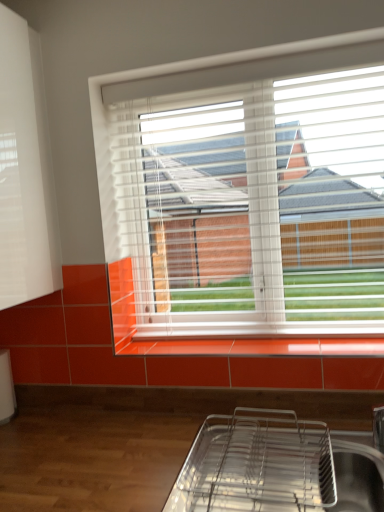
Where is `white plastic blinds at upper center`? white plastic blinds at upper center is located at coordinates (250, 192).

What do you see at coordinates (25, 170) in the screenshot?
I see `white matte shutter at upper left` at bounding box center [25, 170].

You are a GUI agent. You are given a task and a screenshot of the screen. Output one action in this format:
    pyautogui.click(x=<x>, y=<y>)
    Task: Click on the white plastic blinds at upper center
    This screenshot has height=512, width=384.
    Given the screenshot: What is the action you would take?
    pyautogui.click(x=250, y=192)

In the scene shown: Is white matte shutter at upper left bigger or smaller than metallic silver tray at lower center?

white matte shutter at upper left is bigger than metallic silver tray at lower center.

Is white matte shutter at upper left aimed at metallic silver tray at lower center?

No, white matte shutter at upper left is not turned towards metallic silver tray at lower center.

Is metallic silver tray at lower center inside white matte shutter at upper left?

No, metallic silver tray at lower center is located outside of white matte shutter at upper left.

From the image's perspective, is orange glossy tile at lower center located above or below white matte shutter at upper left?

orange glossy tile at lower center is situated lower than white matte shutter at upper left in the image.

Can you confirm if orange glossy tile at lower center is smaller than white matte shutter at upper left?

Indeed, orange glossy tile at lower center has a smaller size compared to white matte shutter at upper left.

Which is behind, orange glossy tile at lower center or white matte shutter at upper left?

orange glossy tile at lower center.

Which of these two, orange glossy tile at lower center or white matte shutter at upper left, is thinner?

Thinner between the two is orange glossy tile at lower center.

Is metallic silver tray at lower center wider than white plastic blinds at upper center?

Correct, the width of metallic silver tray at lower center exceeds that of white plastic blinds at upper center.

Is metallic silver tray at lower center located outside white plastic blinds at upper center?

That's correct, metallic silver tray at lower center is outside of white plastic blinds at upper center.

Considering the positions of points (267, 487) and (184, 68), is point (267, 487) farther from camera compared to point (184, 68)?

No, (267, 487) is in front of (184, 68).

From a real-world perspective, between metallic silver tray at lower center and white plastic blinds at upper center, who is vertically lower?

metallic silver tray at lower center.

Between point (136, 342) and point (195, 75), which one is positioned in front?

Point (195, 75)

From a real-world perspective, is orange glossy tile at lower center over white plastic blinds at upper center?

No.

Is orange glossy tile at lower center wider than white plastic blinds at upper center?

Yes.

In the image, there is a white plastic blinds at upper center. Find the location of `window sill below it (from a real-world perspective)`. window sill below it (from a real-world perspective) is located at coordinates (251, 346).

Can you confirm if metallic silver tray at lower center is positioned to the right of white matte shutter at upper left?

Yes, metallic silver tray at lower center is to the right of white matte shutter at upper left.

Locate an element on the screen. The image size is (384, 512). appliance located underneath the white matte shutter at upper left (from a real-world perspective) is located at coordinates (256, 464).

Do you think metallic silver tray at lower center is within white matte shutter at upper left, or outside of it?

metallic silver tray at lower center is spatially situated outside white matte shutter at upper left.

Between metallic silver tray at lower center and white matte shutter at upper left, which one has more height?

white matte shutter at upper left.

Does white matte shutter at upper left have a lesser height compared to white plastic blinds at upper center?

Yes, white matte shutter at upper left is shorter than white plastic blinds at upper center.

Is white plastic blinds at upper center surrounded by white matte shutter at upper left?

No, white plastic blinds at upper center is not a part of white matte shutter at upper left.

Relative to white plastic blinds at upper center, is white matte shutter at upper left in front or behind?

In the image, white matte shutter at upper left appears in front of white plastic blinds at upper center.

From a real-world perspective, who is located lower, white matte shutter at upper left or white plastic blinds at upper center?

white plastic blinds at upper center.

From a real-world perspective, is white plastic blinds at upper center physically above metallic silver tray at lower center?

Correct, in the physical world, white plastic blinds at upper center is higher than metallic silver tray at lower center.

Is white plastic blinds at upper center facing towards metallic silver tray at lower center?

No, white plastic blinds at upper center is not oriented towards metallic silver tray at lower center.

Between point (162, 179) and point (214, 424), which one is positioned in front?

The point (214, 424) is closer.

You are a GUI agent. You are given a task and a screenshot of the screen. Output one action in this format:
    pyautogui.click(x=<x>, y=<y>)
    Task: Click on the appliance below the white matte shutter at upper left (from a real-world perspective)
    
    Given the screenshot: What is the action you would take?
    pyautogui.click(x=256, y=464)

The height and width of the screenshot is (512, 384). What are the coordinates of `shutter in front of the orange glossy tile at lower center` in the screenshot? It's located at (25, 170).

Looking at the image, which one is located closer to white matte shutter at upper left, metallic silver tray at lower center or white plastic blinds at upper center?

white plastic blinds at upper center is closer to white matte shutter at upper left.

Based on their spatial positions, is metallic silver tray at lower center or white matte shutter at upper left further from orange glossy tile at lower center?

Based on the image, white matte shutter at upper left appears to be further to orange glossy tile at lower center.

Which object lies nearer to the anchor point white plastic blinds at upper center, metallic silver tray at lower center or white matte shutter at upper left?

white matte shutter at upper left lies closer to white plastic blinds at upper center than the other object.

From the image, which object appears to be farther from white matte shutter at upper left, metallic silver tray at lower center or orange glossy tile at lower center?

metallic silver tray at lower center is positioned further to the anchor white matte shutter at upper left.

From the picture: Which object lies further to the anchor point white plastic blinds at upper center, white matte shutter at upper left or metallic silver tray at lower center?

Based on the image, metallic silver tray at lower center appears to be further to white plastic blinds at upper center.

Looking at the image, which one is located further to white plastic blinds at upper center, orange glossy tile at lower center or metallic silver tray at lower center?

Based on the image, metallic silver tray at lower center appears to be further to white plastic blinds at upper center.

Considering their positions, is white plastic blinds at upper center positioned further to white matte shutter at upper left than orange glossy tile at lower center?

Among the two, orange glossy tile at lower center is located further to white matte shutter at upper left.

Estimate the real-world distances between objects in this image. Which object is closer to orange glossy tile at lower center, white matte shutter at upper left or white plastic blinds at upper center?

white plastic blinds at upper center.

The height and width of the screenshot is (512, 384). Identify the location of window sill between white matte shutter at upper left and white plastic blinds at upper center. (251, 346).

This screenshot has width=384, height=512. In order to click on appliance situated between white matte shutter at upper left and white plastic blinds at upper center from left to right in this screenshot , I will do `click(256, 464)`.

You are a GUI agent. You are given a task and a screenshot of the screen. Output one action in this format:
    pyautogui.click(x=<x>, y=<y>)
    Task: Click on the window sill between white plastic blinds at upper center and metallic silver tray at lower center from top to bottom
    Image resolution: width=384 pixels, height=512 pixels.
    Given the screenshot: What is the action you would take?
    pyautogui.click(x=251, y=346)

Find the location of a particular element. appliance between white matte shutter at upper left and orange glossy tile at lower center is located at coordinates (256, 464).